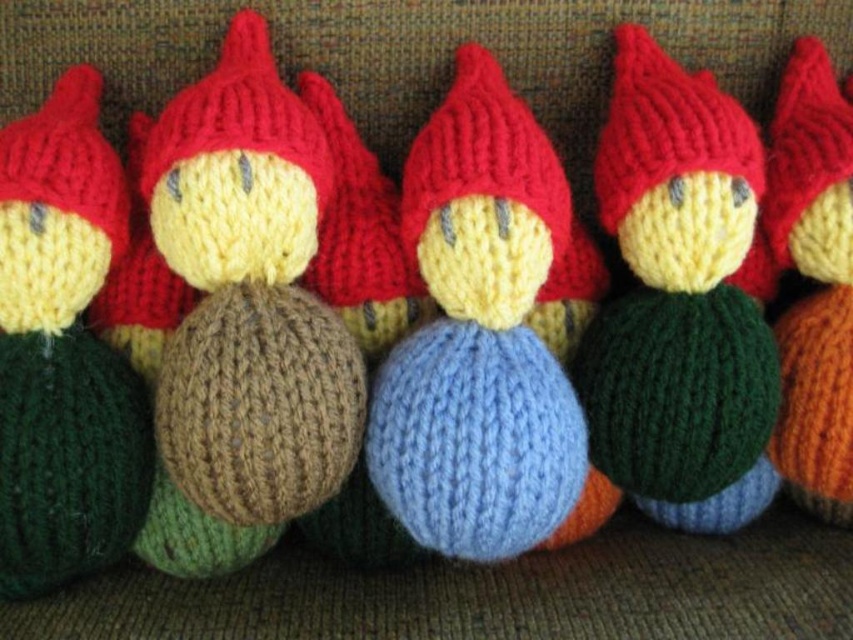
Question: Which point appears closest to the camera in this image?

Choices:
 (A) (526, 497)
 (B) (328, 344)

Answer: (A)

Question: Which point is farther to the camera?

Choices:
 (A) blue knitted ball at center
 (B) knitted brown ball at center
 (C) green knitted ball at center

Answer: (C)

Question: Is knitted brown ball at center above green knitted ball at center?

Choices:
 (A) yes
 (B) no

Answer: (B)

Question: Can you confirm if blue knitted ball at center is wider than green knitted ball at center?

Choices:
 (A) yes
 (B) no

Answer: (A)

Question: Is green knitted ball at center below green knitted ball at left?

Choices:
 (A) yes
 (B) no

Answer: (B)

Question: Which point appears farthest from the camera in this image?

Choices:
 (A) (207, 449)
 (B) (561, 228)
 (C) (680, 262)
 (D) (62, 456)

Answer: (B)